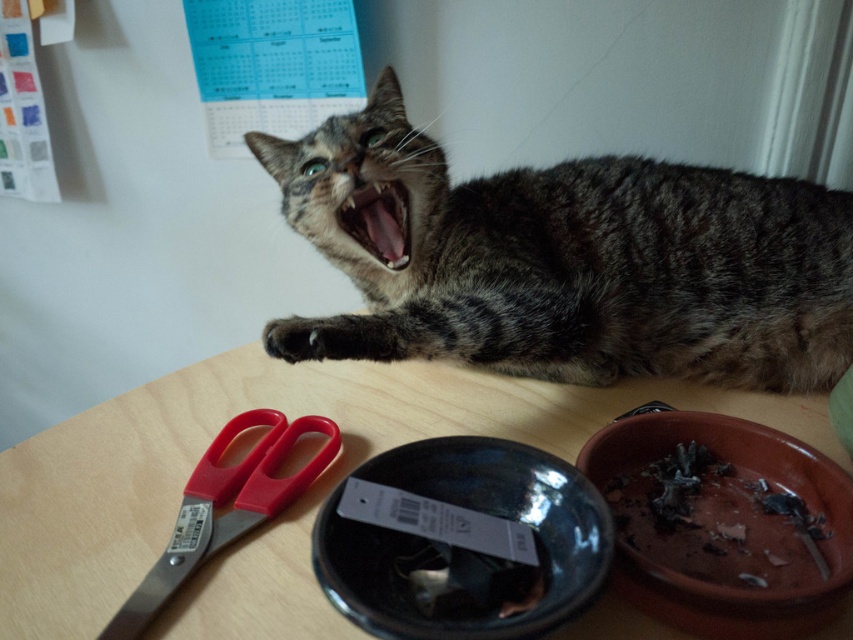
Question: Among these points, which one is nearest to the camera?

Choices:
 (A) (386, 204)
 (B) (747, 440)

Answer: (B)

Question: Which object is closer to the camera taking this photo?

Choices:
 (A) brown matte bowl at lower right
 (B) glossy ceramic bowl at lower center
 (C) tabby fur cat at upper center
 (D) wooden table at upper center

Answer: (B)

Question: Which object is the farthest from the glossy ceramic bowl at lower center?

Choices:
 (A) wooden table at upper center
 (B) red plastic scissors at lower left

Answer: (B)

Question: Can you confirm if tabby fur cat at upper center is smaller than brown matte bowl at lower right?

Choices:
 (A) no
 (B) yes

Answer: (A)

Question: From the image, what is the correct spatial relationship of wooden table at upper center in relation to brown matte bowl at lower right?

Choices:
 (A) right
 (B) left

Answer: (B)

Question: Is wooden table at upper center in front of glossy ceramic bowl at lower center?

Choices:
 (A) yes
 (B) no

Answer: (B)